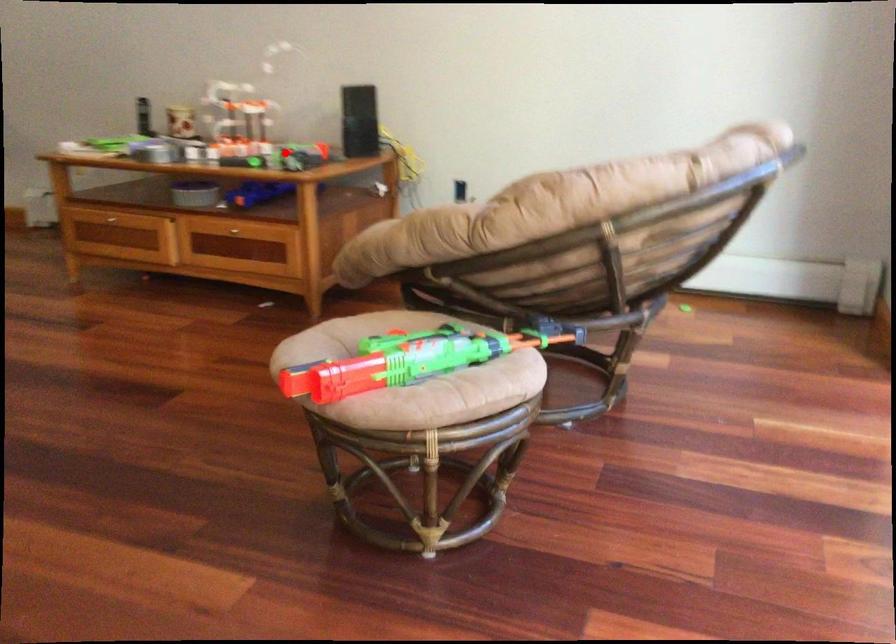
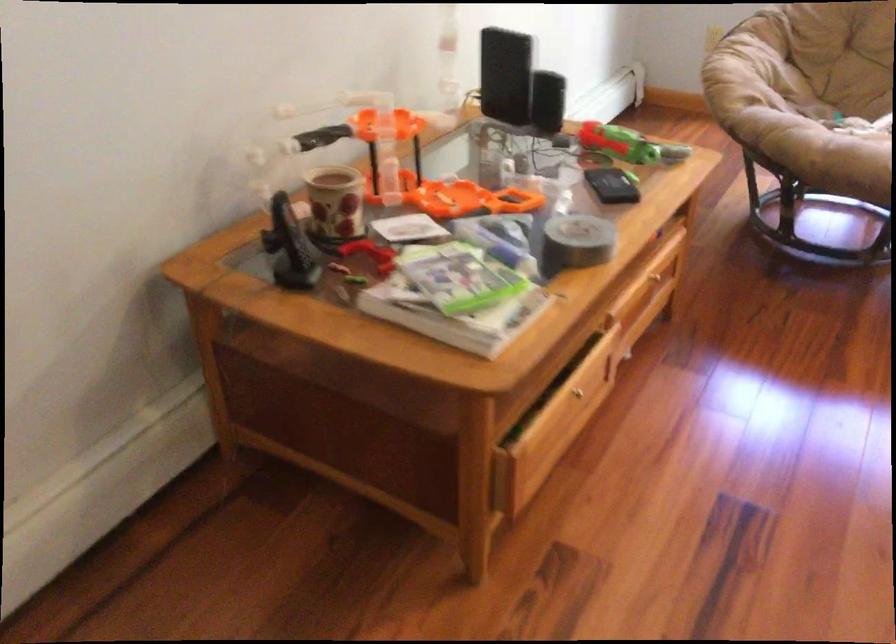
Question: I am providing you with two images of the same scene from different viewpoints. A red point is marked on the first image. At the location where the point appears in image 1, is it still visible in image 2?

Choices:
 (A) Yes
 (B) No

Answer: (A)